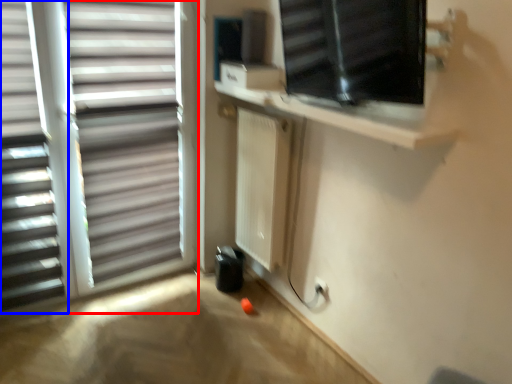
Question: Which point is closer to the camera, window (highlighted by a red box) or window blind (highlighted by a blue box)?

Choices:
 (A) window
 (B) window blind

Answer: (B)